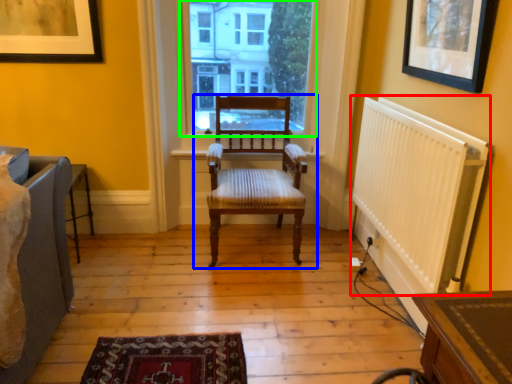
Question: Which is farther away from radiator (highlighted by a red box)? chair (highlighted by a blue box) or window (highlighted by a green box)?

Choices:
 (A) chair
 (B) window

Answer: (B)